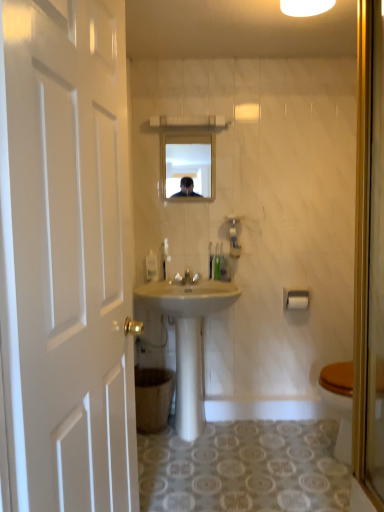
Question: Is brown cardboard trash bin/can at lower left taller than white glossy light fixture at upper center?

Choices:
 (A) no
 (B) yes

Answer: (B)

Question: Considering the relative sizes of brown cardboard trash bin/can at lower left and white glossy light fixture at upper center in the image provided, is brown cardboard trash bin/can at lower left wider than white glossy light fixture at upper center?

Choices:
 (A) yes
 (B) no

Answer: (A)

Question: Is the depth of brown cardboard trash bin/can at lower left greater than that of white glossy light fixture at upper center?

Choices:
 (A) yes
 (B) no

Answer: (A)

Question: Is brown cardboard trash bin/can at lower left placed right next to white glossy light fixture at upper center?

Choices:
 (A) yes
 (B) no

Answer: (B)

Question: From a real-world perspective, is brown cardboard trash bin/can at lower left on white glossy light fixture at upper center?

Choices:
 (A) no
 (B) yes

Answer: (A)

Question: Are brown cardboard trash bin/can at lower left and white glossy light fixture at upper center far apart?

Choices:
 (A) yes
 (B) no

Answer: (A)

Question: Does white plastic towel bar at upper right have a smaller size compared to green plastic toothbrushes at center, which is counted as the second toiletries, starting from the right?

Choices:
 (A) yes
 (B) no

Answer: (B)

Question: Considering the relative sizes of white plastic towel bar at upper right and green plastic toothbrushes at center, which is counted as the second toiletries, starting from the right, in the image provided, is white plastic towel bar at upper right wider than green plastic toothbrushes at center, which is counted as the second toiletries, starting from the right,?

Choices:
 (A) yes
 (B) no

Answer: (A)

Question: From the image's perspective, does white plastic towel bar at upper right appear lower than green plastic toothbrushes at center, which is counted as the second toiletries, starting from the right?

Choices:
 (A) yes
 (B) no

Answer: (A)

Question: Considering the relative positions of white plastic towel bar at upper right and green plastic toothbrushes at center, which is counted as the second toiletries, starting from the right, in the image provided, is white plastic towel bar at upper right to the left of green plastic toothbrushes at center, which is counted as the second toiletries, starting from the right, from the viewer's perspective?

Choices:
 (A) yes
 (B) no

Answer: (B)

Question: Is white plastic towel bar at upper right positioned far away from green plastic toothbrushes at center, the 2th toiletries from the left?

Choices:
 (A) no
 (B) yes

Answer: (A)

Question: From the image's perspective, is white plastic towel bar at upper right above green plastic toothbrushes at center, which is counted as the second toiletries, starting from the right?

Choices:
 (A) no
 (B) yes

Answer: (A)

Question: Is white glossy faucet at center facing towards white glossy light fixture at upper center?

Choices:
 (A) no
 (B) yes

Answer: (A)